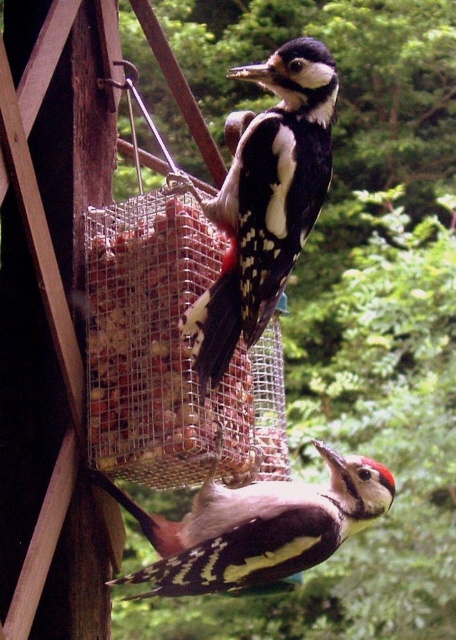
You are a birdwatcher observing the speckled brown woodpecker at center and the smooth mesh container at center. Which object is positioned higher in the scene?

The speckled brown woodpecker at center is positioned higher than the smooth mesh container at center.

You are a birdwatcher trying to determine the relative sizes of the birds in the scene. Which object is wider, the smooth mesh container at center or the speckled brown woodpecker at center?

The smooth mesh container at center is wider than the speckled brown woodpecker at center according to the description.